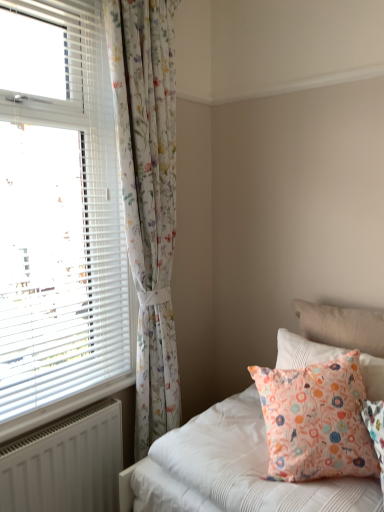
Identify the location of free spot above white plastic radiator at lower left (from a real-world perspective). (79, 392).